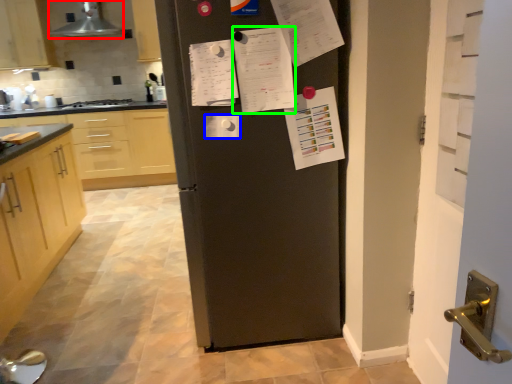
Question: Which object is the closest to the exhaust hood (highlighted by a red box)? Choose among these: paper (highlighted by a blue box) or list (highlighted by a green box).

Choices:
 (A) paper
 (B) list

Answer: (B)